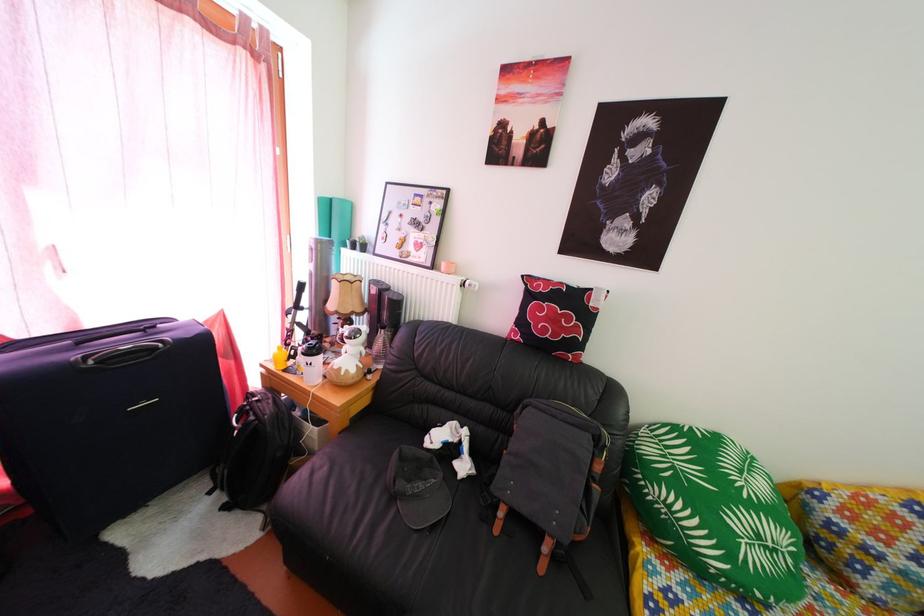
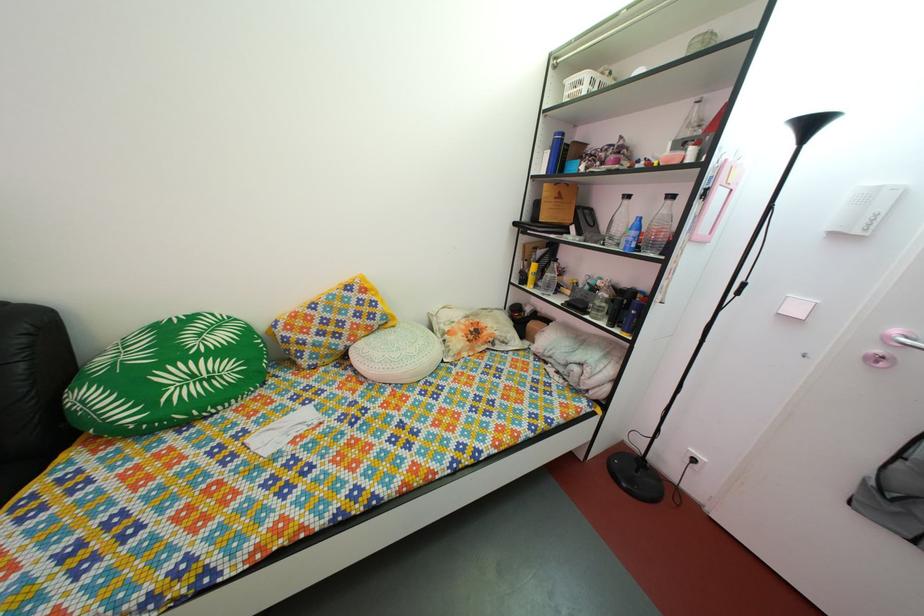
In the second image, find the point that corresponds to (784,560) in the first image.

(220, 387)